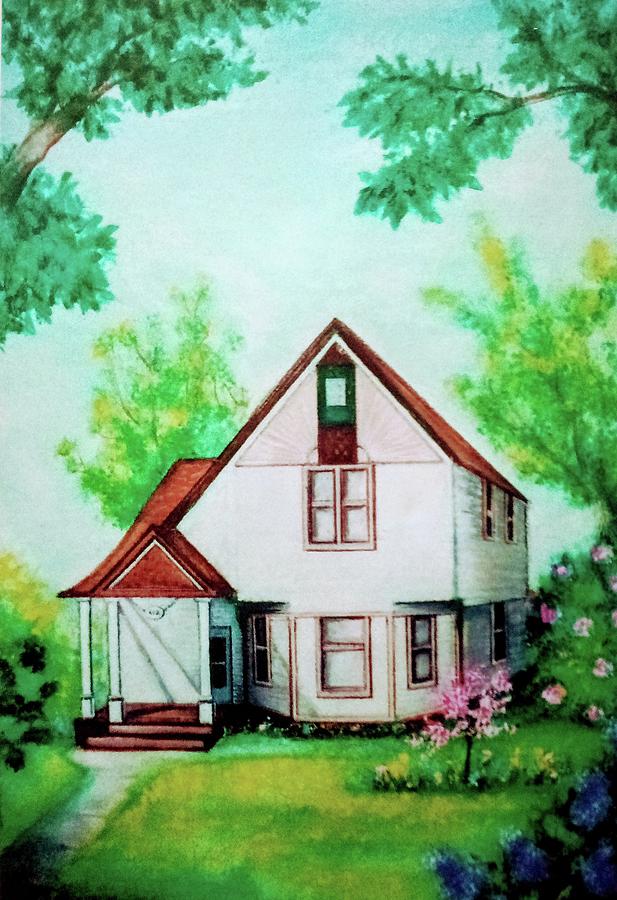
Where is `window`? window is located at coordinates (320, 495), (339, 653), (262, 645), (232, 652), (421, 661), (495, 644), (485, 520), (503, 522).